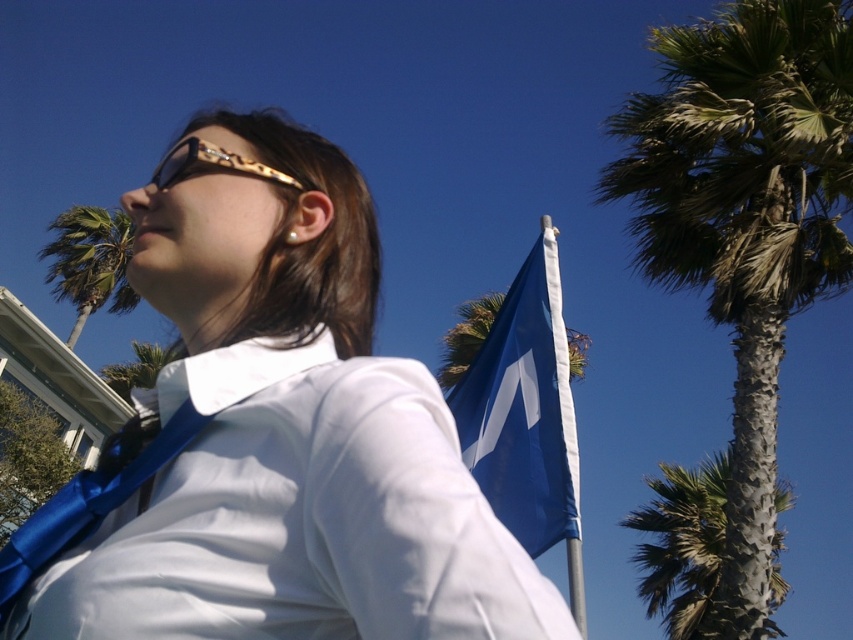
From the picture: Is green leafy palm tree at right above green leafy palm tree at upper left?

No.

Is green leafy palm tree at right taller than green leafy palm tree at upper left?

Indeed, green leafy palm tree at right has a greater height compared to green leafy palm tree at upper left.

Between point (709, 458) and point (122, 362), which one is positioned in front?

Point (709, 458) is in front.

Where is `green leafy palm tree at right`? green leafy palm tree at right is located at coordinates (683, 545).

Does green leafy palm tree at right appear on the right side of shiny blue tie at center?

Yes, green leafy palm tree at right is to the right of shiny blue tie at center.

Is green leafy palm tree at right above shiny blue tie at center?

Incorrect, green leafy palm tree at right is not positioned above shiny blue tie at center.

Which is in front, point (722, 508) or point (115, 502)?

Point (115, 502) is more forward.

You are a GUI agent. You are given a task and a screenshot of the screen. Output one action in this format:
    pyautogui.click(x=<x>, y=<y>)
    Task: Click on the green leafy palm tree at right
    
    Given the screenshot: What is the action you would take?
    click(x=683, y=545)

Does blue fabric flag at upper right have a greater width compared to gold textured goggles at upper center?

No.

The width and height of the screenshot is (853, 640). What do you see at coordinates (524, 410) in the screenshot?
I see `blue fabric flag at upper right` at bounding box center [524, 410].

Is point (531, 324) positioned behind point (167, 170)?

Yes.

You are a GUI agent. You are given a task and a screenshot of the screen. Output one action in this format:
    pyautogui.click(x=<x>, y=<y>)
    Task: Click on the blue fabric flag at upper right
    
    Given the screenshot: What is the action you would take?
    524,410